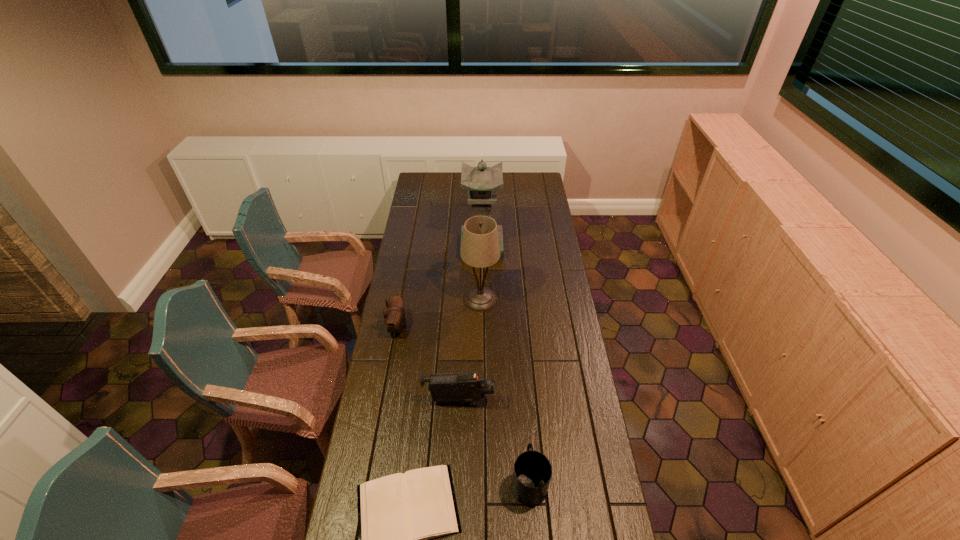
Find the location of a particular element. Image resolution: width=960 pixels, height=540 pixels. free spot at the far left corner of the desktop is located at coordinates (435, 190).

Find the location of a particular element. free space at the far right corner of the desktop is located at coordinates (531, 183).

Find the location of `vacant region between the sculpture and the third tallest object`. vacant region between the sculpture and the third tallest object is located at coordinates (470, 324).

Identify the location of free space between the mug and the pouch. (464, 404).

The width and height of the screenshot is (960, 540). I want to click on empty location between the fifth shortest object and the farthest object, so click(481, 273).

Where is `vacant space that is in between the mug and the fourth shortest object`? Image resolution: width=960 pixels, height=540 pixels. vacant space that is in between the mug and the fourth shortest object is located at coordinates (494, 442).

I want to click on empty space that is in between the farthest object and the fourth nearest object, so click(x=440, y=287).

Identify the location of free space between the sculpture and the fourth nearest object. This screenshot has width=960, height=540. (440, 287).

The height and width of the screenshot is (540, 960). In order to click on free space between the second farthest object and the sculpture in this screenshot , I will do `click(481, 273)`.

Locate an element on the screen. empty space between the farthest object and the pouch is located at coordinates (440, 287).